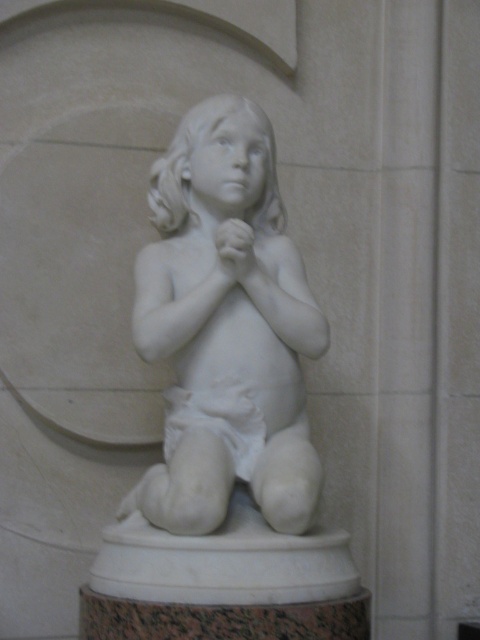
Question: Which point is farther to the camera?

Choices:
 (A) white matte diaper at center
 (B) white marble statue at center

Answer: (A)

Question: Which of the following is the farthest from the observer?

Choices:
 (A) (311, 472)
 (B) (227, 388)

Answer: (B)

Question: Is white marble statue at center in front of white matte diaper at center?

Choices:
 (A) no
 (B) yes

Answer: (B)

Question: Does white marble statue at center have a smaller size compared to white matte diaper at center?

Choices:
 (A) yes
 (B) no

Answer: (B)

Question: Among these objects, which one is nearest to the camera?

Choices:
 (A) white matte diaper at center
 (B) white marble statue at center

Answer: (B)

Question: Does white marble statue at center have a smaller size compared to white matte diaper at center?

Choices:
 (A) no
 (B) yes

Answer: (A)